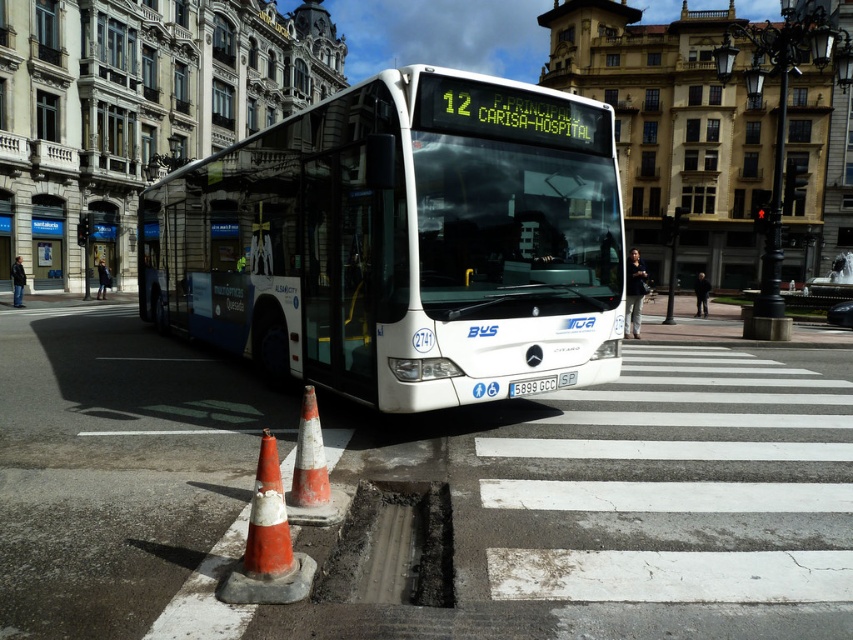
You are standing at the point marked by the coordinates point (268, 544). What object are you standing on?

You are standing on the orange white plastic traffic cone at lower center.

You are a pedestrian waiting at the metallic glass bus stop at left. You want to board the white glossy bus at center when it arrives. Which direction should you walk to reach the bus once it stops?

You should walk to your right because the white glossy bus at center is to the right of the metallic glass bus stop at left.

You are a pedestrian trying to cross the street. You see the white glossy bus at center and the metallic glass bus stop at left. Which object is bigger?

The white glossy bus at center is larger in size than the metallic glass bus stop at left.